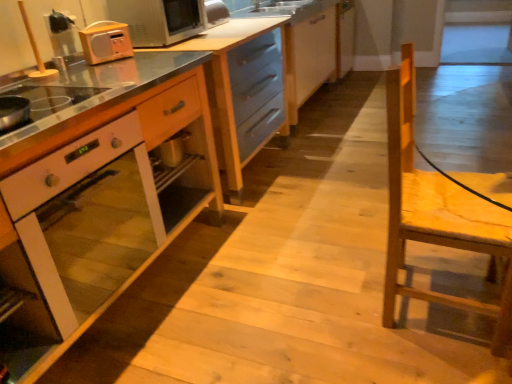
Locate an element on the screen. vacant area to the left of light brown wooden chair at right is located at coordinates (339, 309).